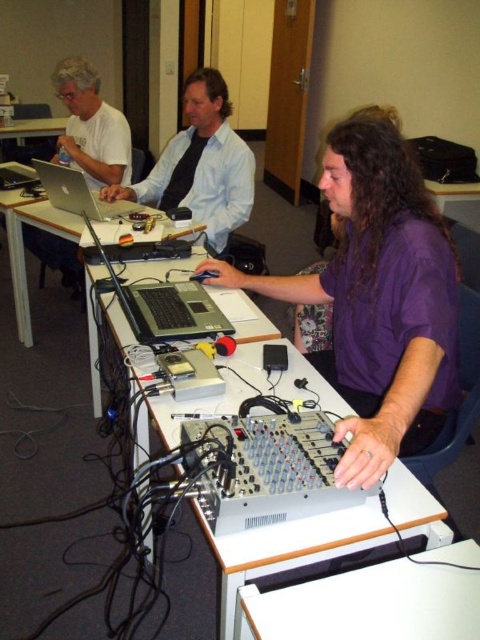
Does purple matte shirt at center appear on the right side of silver metallic laptop at left?

Indeed, purple matte shirt at center is positioned on the right side of silver metallic laptop at left.

I want to click on purple matte shirt at center, so click(379, 300).

Describe the element at coordinates (288, 545) in the screenshot. The height and width of the screenshot is (640, 480). I see `silver metallic table at center` at that location.

Does silver metallic table at center have a greater width compared to matte black shirt at center?

Yes, silver metallic table at center is wider than matte black shirt at center.

What do you see at coordinates (288, 545) in the screenshot?
I see `silver metallic table at center` at bounding box center [288, 545].

Find the location of a particular element. silver metallic table at center is located at coordinates (288, 545).

Who is lower down, white plastic table at lower center or matte black shirt at center?

Positioned lower is white plastic table at lower center.

Locate an element on the screen. This screenshot has width=480, height=640. white plastic table at lower center is located at coordinates (368, 605).